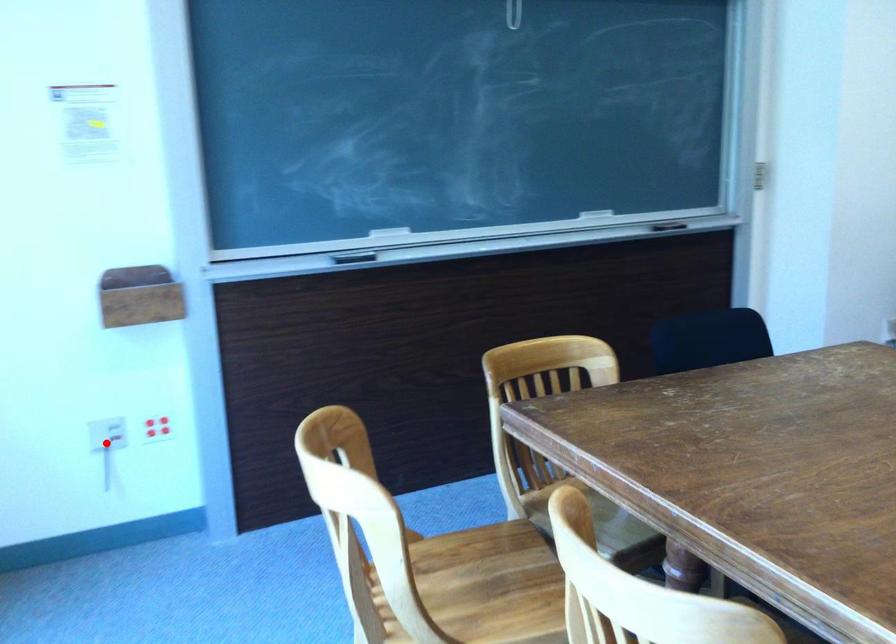
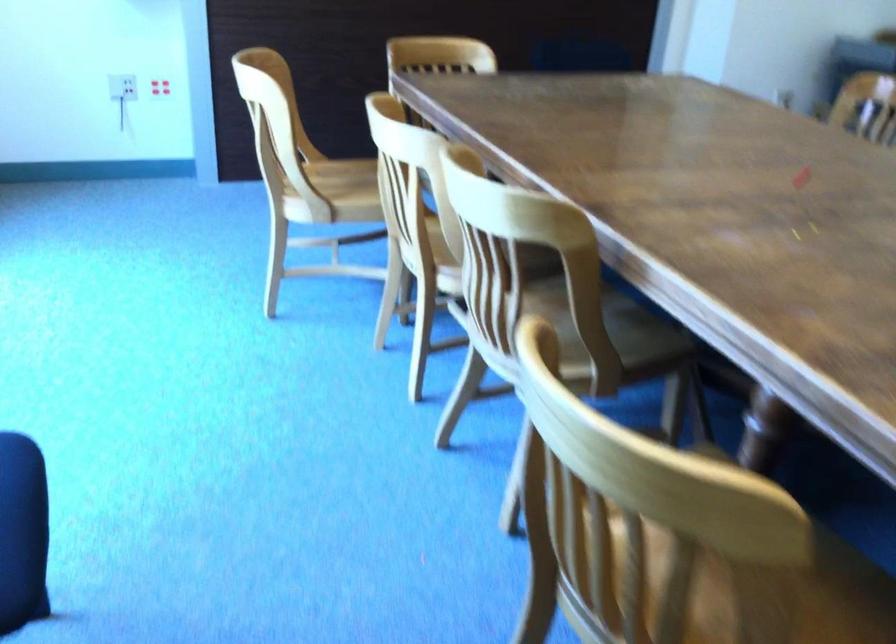
Question: I am providing you with two images of the same scene from different viewpoints. Given a red point in image1, look at the same physical point in image2. Is it:

Choices:
 (A) Closer to the viewpoint
 (B) Farther from the viewpoint

Answer: (B)